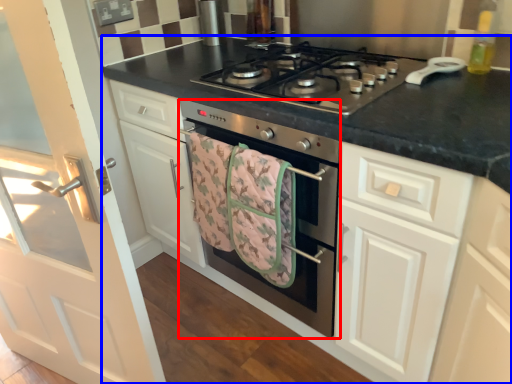
Question: Which object is further to the camera taking this photo, oven (highlighted by a red box) or countertop (highlighted by a blue box)?

Choices:
 (A) oven
 (B) countertop

Answer: (A)